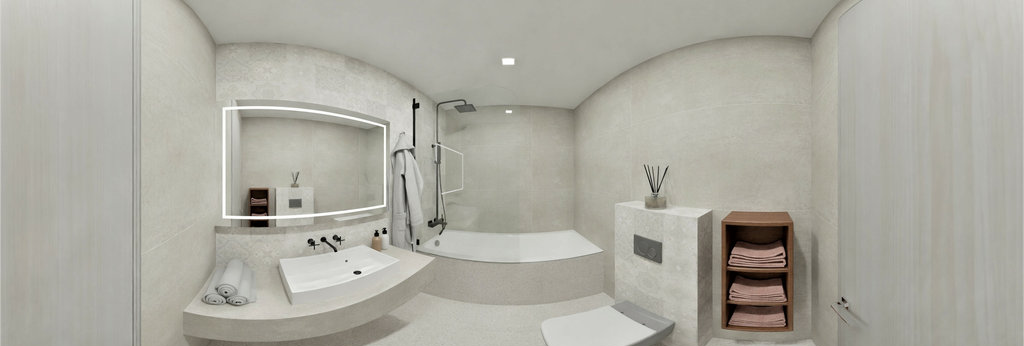
Where is `faucet`? Image resolution: width=1024 pixels, height=346 pixels. faucet is located at coordinates (327, 243).